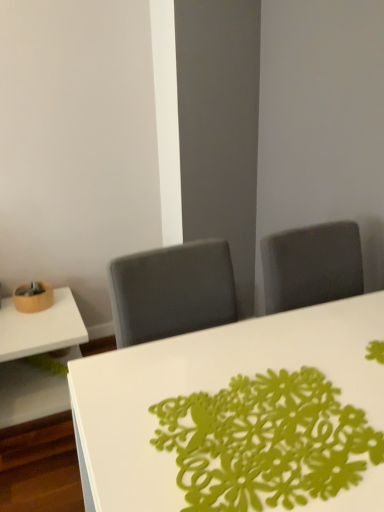
Image resolution: width=384 pixels, height=512 pixels. I want to click on free space above green paper doily at center (from a real-world perspective), so click(x=270, y=426).